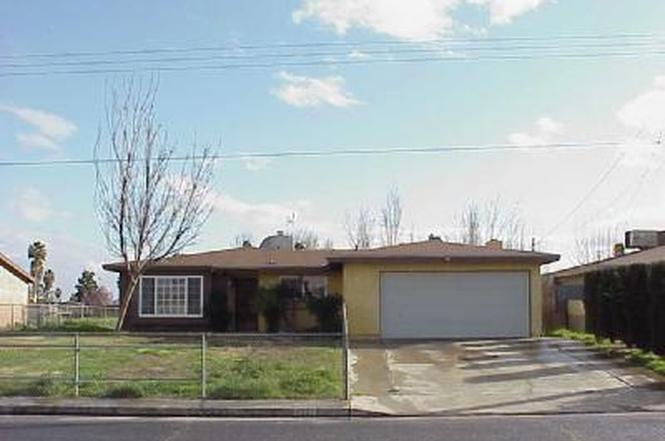
What are the coordinates of `2 visible front windows` in the screenshot? It's located at (315, 291), (167, 295).